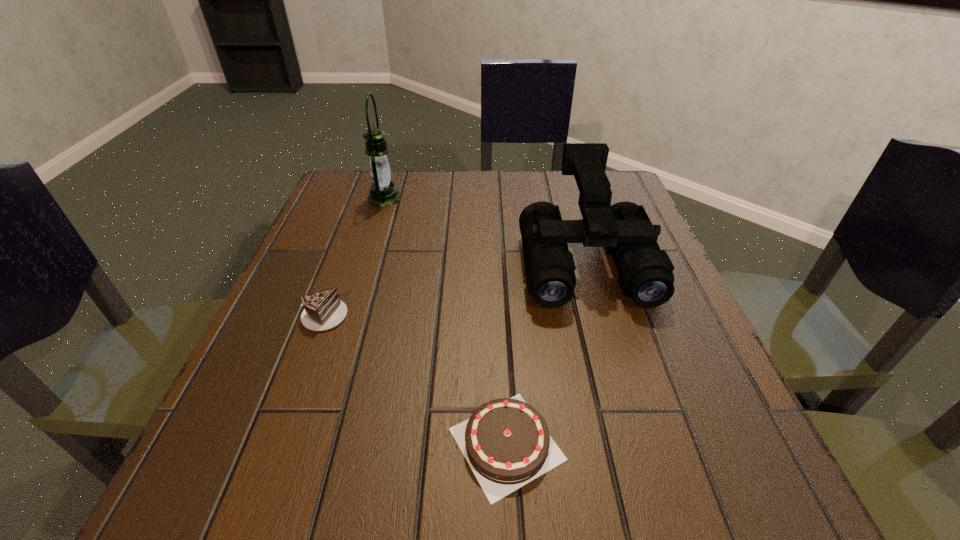
Where is `free point between the third tallest object and the second tallest object`? This screenshot has width=960, height=540. free point between the third tallest object and the second tallest object is located at coordinates (454, 287).

Where is `free space between the third shortest object and the lantern`? The image size is (960, 540). free space between the third shortest object and the lantern is located at coordinates [x=485, y=229].

I want to click on empty location between the taller chocolate cake and the farthest object, so (x=354, y=256).

Locate an element on the screen. This screenshot has height=540, width=960. unoccupied area between the right chocolate cake and the binoculars is located at coordinates (545, 352).

Find the location of a particular element. The height and width of the screenshot is (540, 960). empty space that is in between the right chocolate cake and the taller chocolate cake is located at coordinates (415, 379).

Find the location of a particular element. The width and height of the screenshot is (960, 540). vacant space that is in between the shortest object and the farthest object is located at coordinates (445, 321).

Select which object is the second closest to the second shortest object. Please provide its 2D coordinates. Your answer should be formatted as a tuple, i.e. [(x, y)], where the tuple contains the x and y coordinates of a point satisfying the conditions above.

[(383, 193)]

Choose which object is the second nearest neighbor to the second shortest object. Please provide its 2D coordinates. Your answer should be formatted as a tuple, i.e. [(x, y)], where the tuple contains the x and y coordinates of a point satisfying the conditions above.

[(383, 193)]

Locate an element on the screen. This screenshot has width=960, height=540. free location that satisfies the following two spatial constraints: 1. on the side where the lantern emits light; 2. on the front side of the farther chocolate cake is located at coordinates (348, 314).

Identify the location of free spot that satisfies the following two spatial constraints: 1. on the side where the farthest object emits light; 2. on the left side of the nearest object. The height and width of the screenshot is (540, 960). [307, 444].